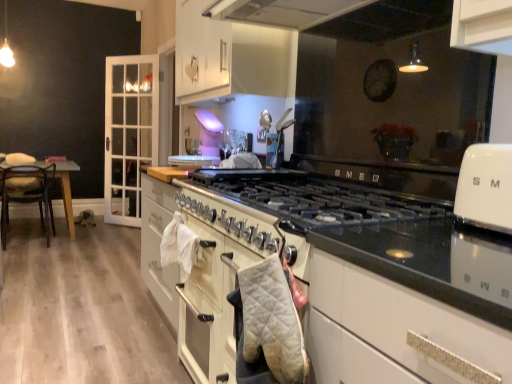
Measure the distance between point (25, 188) and camera.

Point (25, 188) is 4.36 meters away from camera.

The image size is (512, 384). In order to click on wooden chair at left in this screenshot , I will do `click(27, 195)`.

The height and width of the screenshot is (384, 512). Describe the element at coordinates (267, 326) in the screenshot. I see `white quilted oven mitt at center` at that location.

The image size is (512, 384). What do you see at coordinates (217, 278) in the screenshot?
I see `white quilted oven mitt at center` at bounding box center [217, 278].

What is the approximate width of white glossy cabinet at upper center, the second cabinetry in the back-to-front sequence?

40.75 centimeters.

Where is `white glossy oven at upper right`? This screenshot has height=384, width=512. white glossy oven at upper right is located at coordinates (485, 187).

The width and height of the screenshot is (512, 384). Describe the element at coordinates (485, 187) in the screenshot. I see `white glossy oven at upper right` at that location.

This screenshot has height=384, width=512. What do you see at coordinates (129, 133) in the screenshot?
I see `white glossy cabinet at left, the 2th cabinetry from the right` at bounding box center [129, 133].

Where is `wooden chair at left`? wooden chair at left is located at coordinates (27, 195).

Is wooden chair at left facing away from white glossy cabinet at left, which is counted as the 1th cabinetry, starting from the left?

No.

Can you tell me how much wooden chair at left and white glossy cabinet at left, marked as the first cabinetry in a back-to-front arrangement, differ in facing direction?

There is a 133-degree angle between the facing directions of wooden chair at left and white glossy cabinet at left, marked as the first cabinetry in a back-to-front arrangement.

From the picture: Which is more to the left, wooden chair at left or white glossy cabinet at left, which is counted as the 1th cabinetry, starting from the left?

wooden chair at left.

Looking at their sizes, would you say wooden chair at left is wider or thinner than white glossy cabinet at left, the 2th cabinetry from the right?

wooden chair at left is wider than white glossy cabinet at left, the 2th cabinetry from the right.

Is wooden chair at left next to white glossy cabinet at upper center, the second cabinetry in the back-to-front sequence, and touching it?

No, wooden chair at left is not beside white glossy cabinet at upper center, the second cabinetry in the back-to-front sequence.

Is wooden chair at left at the left side of white glossy cabinet at upper center, which is counted as the first cabinetry, starting from the right?

Indeed, wooden chair at left is positioned on the left side of white glossy cabinet at upper center, which is counted as the first cabinetry, starting from the right.

Based on their sizes in the image, would you say wooden chair at left is bigger or smaller than white glossy cabinet at upper center, the second cabinetry in the back-to-front sequence?

In the image, wooden chair at left appears to be smaller than white glossy cabinet at upper center, the second cabinetry in the back-to-front sequence.

Considering the sizes of objects wooden chair at left and white glossy cabinet at upper center, which ranks as the 1th cabinetry in front-to-back order, in the image provided, who is wider, wooden chair at left or white glossy cabinet at upper center, which ranks as the 1th cabinetry in front-to-back order,?

With larger width is wooden chair at left.

Does white glossy cabinet at left, which is counted as the 1th cabinetry, starting from the left, have a lesser height compared to white glossy oven at upper right?

No, white glossy cabinet at left, which is counted as the 1th cabinetry, starting from the left, is not shorter than white glossy oven at upper right.

Is white glossy cabinet at left, which is counted as the 1th cabinetry, starting from the left, positioned with its back to white glossy oven at upper right?

That's not correct — white glossy cabinet at left, which is counted as the 1th cabinetry, starting from the left, is not looking away from white glossy oven at upper right.

Starting from the white glossy oven at upper right, which cabinetry is the 2nd one behind? Please provide its 2D coordinates.

[(129, 133)]

From the image's perspective, is white glossy cabinet at left, the 2th cabinetry from the right, located beneath white glossy oven at upper right?

No, from the image's perspective, white glossy cabinet at left, the 2th cabinetry from the right, is not beneath white glossy oven at upper right.

Consider the image. Is white glossy cabinet at upper center, the second cabinetry in the back-to-front sequence, behind wooden chair at left?

No.

Based on the photo, is wooden chair at left at the back of white glossy cabinet at upper center, which is counted as the first cabinetry, starting from the right?

No, wooden chair at left is not at the back of white glossy cabinet at upper center, which is counted as the first cabinetry, starting from the right.

How far apart are white glossy cabinet at upper center, which is counted as the first cabinetry, starting from the right, and wooden chair at left?

white glossy cabinet at upper center, which is counted as the first cabinetry, starting from the right, and wooden chair at left are 2.67 meters apart from each other.

From a real-world perspective, between white glossy cabinet at upper center, the second cabinetry viewed from the left, and wooden chair at left, who is vertically higher?

white glossy cabinet at upper center, the second cabinetry viewed from the left.

Do you think white quilted oven mitt at center is within white quilted oven mitt at center, or outside of it?

The correct answer is: inside.

From a real-world perspective, is white quilted oven mitt at center beneath white quilted oven mitt at center?

No.

Consider the image. Which object is further away from the camera, white quilted oven mitt at center or white quilted oven mitt at center?

Positioned behind is white quilted oven mitt at center.

Is white quilted oven mitt at center placed right next to white quilted oven mitt at center?

No, white quilted oven mitt at center is not next to white quilted oven mitt at center.

Looking at their sizes, would you say wooden chair at left is wider or thinner than white quilted oven mitt at center?

In the image, wooden chair at left appears to be wider than white quilted oven mitt at center.

Is wooden chair at left oriented towards white quilted oven mitt at center?

No, wooden chair at left is not turned towards white quilted oven mitt at center.

Relative to white quilted oven mitt at center, is wooden chair at left in front or behind?

Visually, wooden chair at left is located behind white quilted oven mitt at center.

Considering the relative sizes of white glossy cabinet at left, which is counted as the 1th cabinetry, starting from the left, and white quilted oven mitt at center in the image provided, is white glossy cabinet at left, which is counted as the 1th cabinetry, starting from the left, taller than white quilted oven mitt at center?

Correct, white glossy cabinet at left, which is counted as the 1th cabinetry, starting from the left, is much taller as white quilted oven mitt at center.

Does white glossy cabinet at left, which is counted as the 1th cabinetry, starting from the left, appear on the right side of white quilted oven mitt at center?

No, white glossy cabinet at left, which is counted as the 1th cabinetry, starting from the left, is not to the right of white quilted oven mitt at center.

From the image's perspective, is white glossy cabinet at left, marked as the first cabinetry in a back-to-front arrangement, located above or below white quilted oven mitt at center?

white glossy cabinet at left, marked as the first cabinetry in a back-to-front arrangement, is situated higher than white quilted oven mitt at center in the image.

How far apart are white glossy cabinet at left, marked as the first cabinetry in a back-to-front arrangement, and white quilted oven mitt at center?

3.78 meters.

Image resolution: width=512 pixels, height=384 pixels. I want to click on chair below the white glossy cabinet at left, marked as the first cabinetry in a back-to-front arrangement (from the image's perspective), so click(27, 195).

There is a wooden chair at left. Identify the location of the 2nd cabinetry above it (from the image's perspective). The height and width of the screenshot is (384, 512). (230, 57).

Estimate the real-world distances between objects in this image. Which object is closer to white glossy oven at upper right, white glossy cabinet at left, the 2th cabinetry from the right, or white glossy cabinet at upper center, the second cabinetry in the back-to-front sequence?

white glossy cabinet at upper center, the second cabinetry in the back-to-front sequence, is positioned closer to the anchor white glossy oven at upper right.

Looking at the image, which one is located closer to wooden chair at left, white glossy oven at upper right or white glossy cabinet at upper center, the second cabinetry viewed from the left?

white glossy cabinet at upper center, the second cabinetry viewed from the left, is positioned closer to the anchor wooden chair at left.

Based on their spatial positions, is white quilted oven mitt at center or white glossy cabinet at upper center, which ranks as the 1th cabinetry in front-to-back order, closer to wooden chair at left?

Among the two, white glossy cabinet at upper center, which ranks as the 1th cabinetry in front-to-back order, is located nearer to wooden chair at left.

Consider the image. When comparing their distances from white quilted oven mitt at center, does white glossy cabinet at upper center, the second cabinetry viewed from the left, or white quilted oven mitt at center seem closer?

white quilted oven mitt at center lies closer to white quilted oven mitt at center than the other object.

Considering their positions, is white quilted oven mitt at center positioned further to white quilted oven mitt at center than white glossy oven at upper right?

white glossy oven at upper right.

When comparing their distances from white glossy oven at upper right, does white quilted oven mitt at center or white glossy cabinet at left, which is counted as the 1th cabinetry, starting from the left, seem closer?

The object closer to white glossy oven at upper right is white quilted oven mitt at center.

Which object lies further to the anchor point white glossy cabinet at left, which is counted as the 2th cabinetry, starting from the front, white glossy oven at upper right or wooden chair at left?

white glossy oven at upper right is further to white glossy cabinet at left, which is counted as the 2th cabinetry, starting from the front.

When comparing their distances from white quilted oven mitt at center, does white glossy oven at upper right or white glossy cabinet at upper center, the second cabinetry viewed from the left, seem closer?

Among the two, white glossy oven at upper right is located nearer to white quilted oven mitt at center.

Identify the location of kitchen appliance between white quilted oven mitt at center and wooden chair at left from front to back. This screenshot has width=512, height=384. (485, 187).

Locate an element on the screen. This screenshot has width=512, height=384. kitchen appliance between white quilted oven mitt at center and wooden chair at left in the front-back direction is located at coordinates (485, 187).

Find the location of a particular element. Image resolution: width=512 pixels, height=384 pixels. chair between white quilted oven mitt at center and white glossy cabinet at left, the 2th cabinetry from the right, from front to back is located at coordinates (27, 195).

Where is `kitchen appliance between white quilted oven mitt at center and white glossy cabinet at left, which is counted as the 2th cabinetry, starting from the front, along the z-axis`? kitchen appliance between white quilted oven mitt at center and white glossy cabinet at left, which is counted as the 2th cabinetry, starting from the front, along the z-axis is located at coordinates (485, 187).